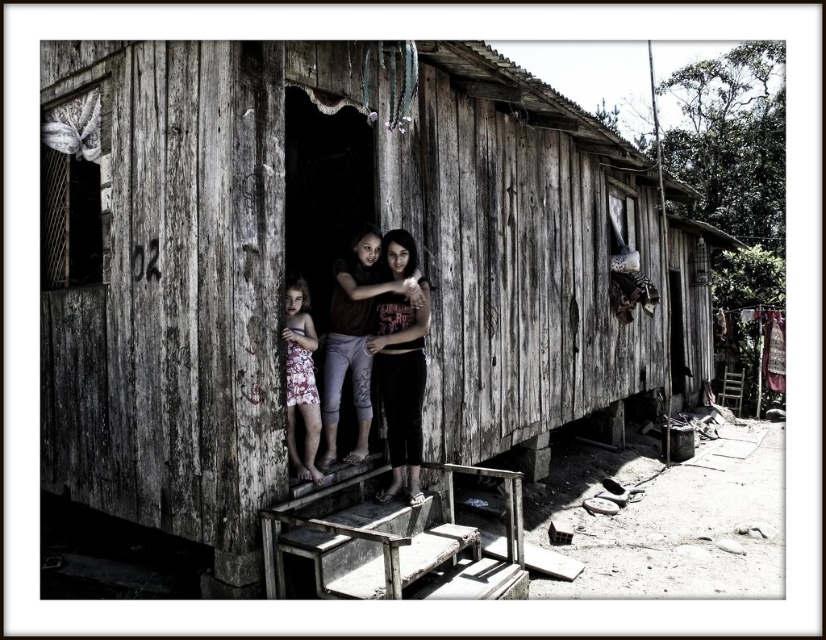
From the picture: Can you confirm if weathered wood hut at center is shorter than dark brown fabric pants at center?

Indeed, weathered wood hut at center has a lesser height compared to dark brown fabric pants at center.

Locate an element on the screen. This screenshot has width=826, height=640. weathered wood hut at center is located at coordinates (336, 268).

Is point (454, 90) in front of point (414, 433)?

No, (454, 90) is behind (414, 433).

This screenshot has height=640, width=826. Find the location of `weathered wood hut at center`. weathered wood hut at center is located at coordinates (336, 268).

Is dark brown fabric pants at center below matte brown shirt at center?

Yes, dark brown fabric pants at center is below matte brown shirt at center.

What do you see at coordinates (401, 364) in the screenshot? The width and height of the screenshot is (826, 640). I see `dark brown fabric pants at center` at bounding box center [401, 364].

Does point (416, 333) come farther from viewer compared to point (323, 365)?

No, (416, 333) is closer to viewer.

Locate an element on the screen. dark brown fabric pants at center is located at coordinates (401, 364).

Consider the image. Does dark brown fabric pants at center have a greater width compared to floral dress at center?

Correct, the width of dark brown fabric pants at center exceeds that of floral dress at center.

Who is lower down, dark brown fabric pants at center or floral dress at center?

Positioned lower is floral dress at center.

Does point (399, 333) lie behind point (288, 339)?

That is True.

Locate an element on the screen. This screenshot has width=826, height=640. dark brown fabric pants at center is located at coordinates click(401, 364).